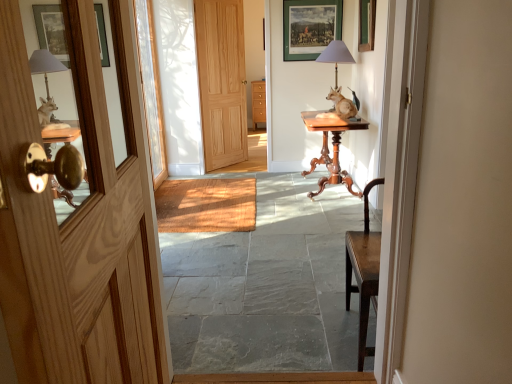
Question: Considering the relative positions of matte green picture frame at upper center and matte gray lampshade at upper center in the image provided, is matte green picture frame at upper center to the right of matte gray lampshade at upper center from the viewer's perspective?

Choices:
 (A) no
 (B) yes

Answer: (A)

Question: From a real-world perspective, is matte green picture frame at upper center physically above matte gray lampshade at upper center?

Choices:
 (A) no
 (B) yes

Answer: (B)

Question: From the image's perspective, is matte green picture frame at upper center above matte gray lampshade at upper center?

Choices:
 (A) yes
 (B) no

Answer: (A)

Question: Is matte green picture frame at upper center not within matte gray lampshade at upper center?

Choices:
 (A) yes
 (B) no

Answer: (A)

Question: Does matte green picture frame at upper center lie behind matte gray lampshade at upper center?

Choices:
 (A) yes
 (B) no

Answer: (A)

Question: Considering the relative sizes of matte green picture frame at upper center and matte gray lampshade at upper center in the image provided, is matte green picture frame at upper center taller than matte gray lampshade at upper center?

Choices:
 (A) yes
 (B) no

Answer: (A)

Question: Could you tell me if smooth stone floor at center is turned towards brown wooden statue at center?

Choices:
 (A) yes
 (B) no

Answer: (B)

Question: Is smooth stone floor at center smaller than brown wooden statue at center?

Choices:
 (A) no
 (B) yes

Answer: (A)

Question: Does smooth stone floor at center appear on the right side of brown wooden statue at center?

Choices:
 (A) yes
 (B) no

Answer: (B)

Question: Would you say smooth stone floor at center is a long distance from brown wooden statue at center?

Choices:
 (A) yes
 (B) no

Answer: (A)

Question: Can brown wooden statue at center be found inside smooth stone floor at center?

Choices:
 (A) no
 (B) yes

Answer: (A)

Question: Is smooth stone floor at center looking in the opposite direction of brown wooden statue at center?

Choices:
 (A) no
 (B) yes

Answer: (A)

Question: Is natural wood door at center, the second door ordered from the bottom, positioned with its back to mahogany wood table at center?

Choices:
 (A) yes
 (B) no

Answer: (B)